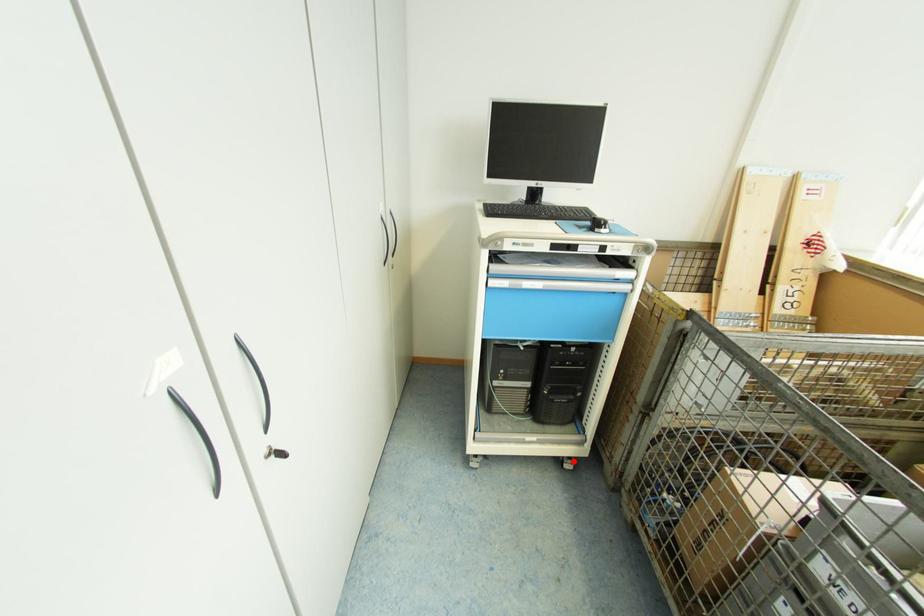
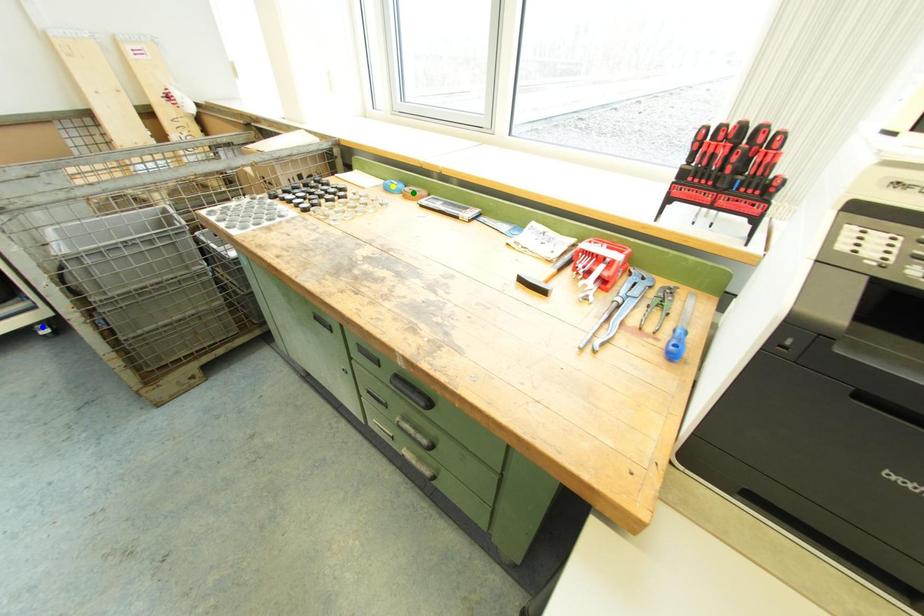
Question: I am providing you with two images of the same scene from different viewpoints. A red point is marked on the first image. You are given multiple points on the second image. In image 2, which mark is for the same physical point as the one in image 1?

Choices:
 (A) yellow point
 (B) green point
 (C) blue point

Answer: (C)